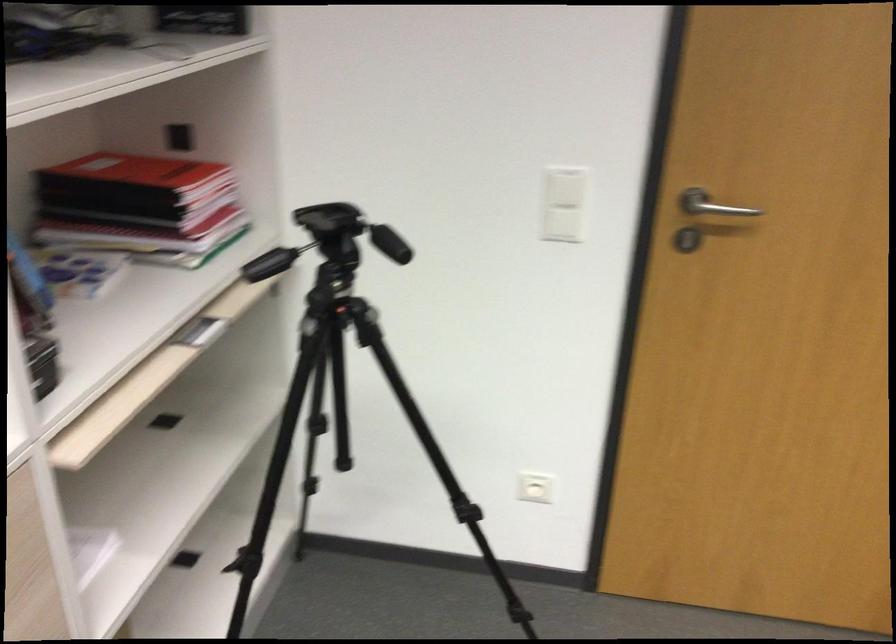
What do you see at coordinates (711, 205) in the screenshot? I see `a silver door handle` at bounding box center [711, 205].